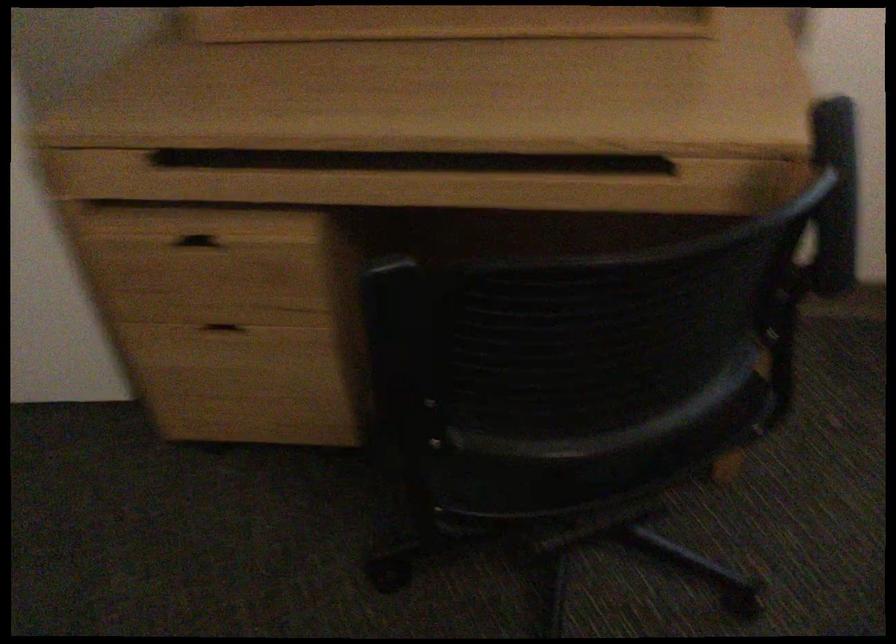
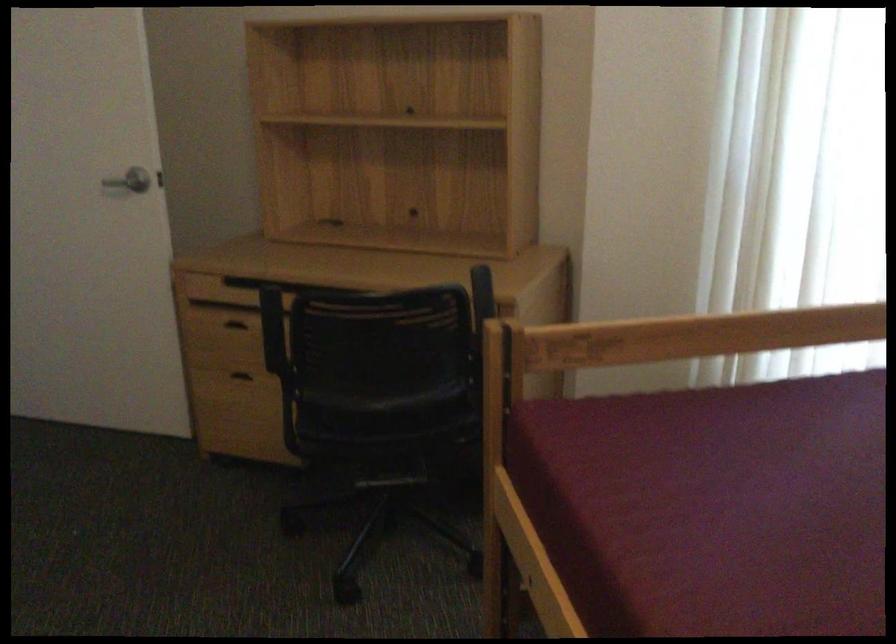
Locate, in the second image, the point that corresponds to [208,242] in the first image.

(240, 323)